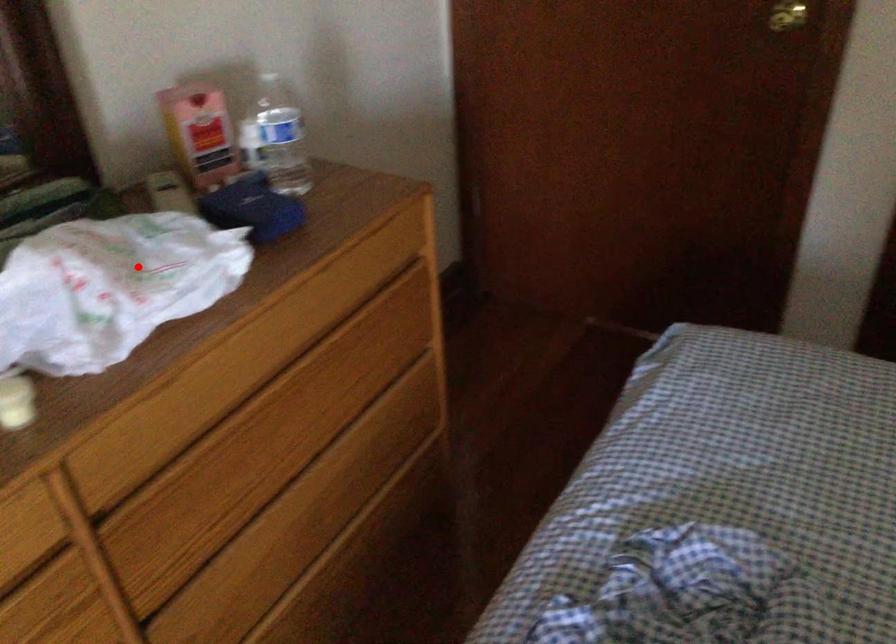
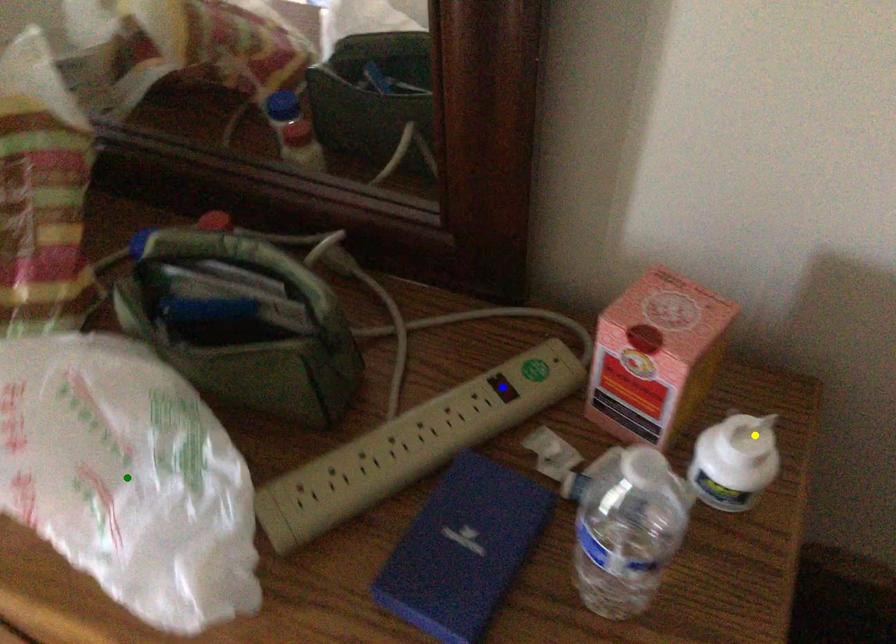
Question: I am providing you with two images of the same scene from different viewpoints. A red point is marked on the first image. You are given multiple points on the second image. Which point in image 2 is actually the same real-world point as the red point in image 1?

Choices:
 (A) green point
 (B) blue point
 (C) yellow point

Answer: (A)